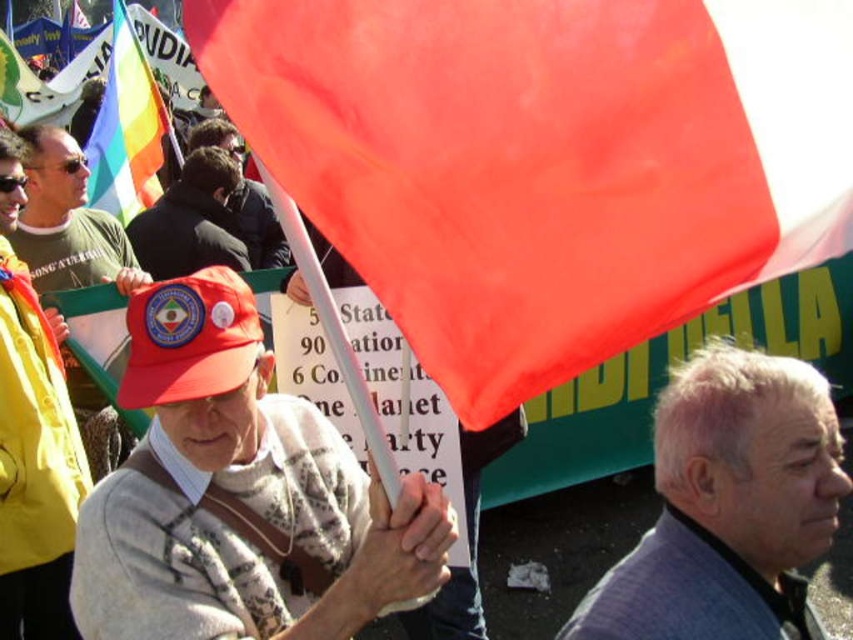
Question: Which object appears farthest from the camera in this image?

Choices:
 (A) rainbow fabric flag at upper left
 (B) gray wool sweater at lower right
 (C) matte orange flag at center

Answer: (A)

Question: Which point appears closest to the camera in this image?

Choices:
 (A) (607, 616)
 (B) (410, 68)
 (C) (177, 147)
 (D) (73, 148)

Answer: (B)

Question: Can you confirm if matte orange flag at center is positioned to the right of matte red cap at left?

Choices:
 (A) no
 (B) yes

Answer: (B)

Question: Which point is closer to the camera?

Choices:
 (A) (276, 484)
 (B) (343, 26)
 (C) (68, 156)

Answer: (B)

Question: Is matte orange flag at center above gray wool sweater at lower right?

Choices:
 (A) yes
 (B) no

Answer: (A)

Question: Is the position of matte orange flag at center less distant than that of gray wool sweater at lower right?

Choices:
 (A) no
 (B) yes

Answer: (B)